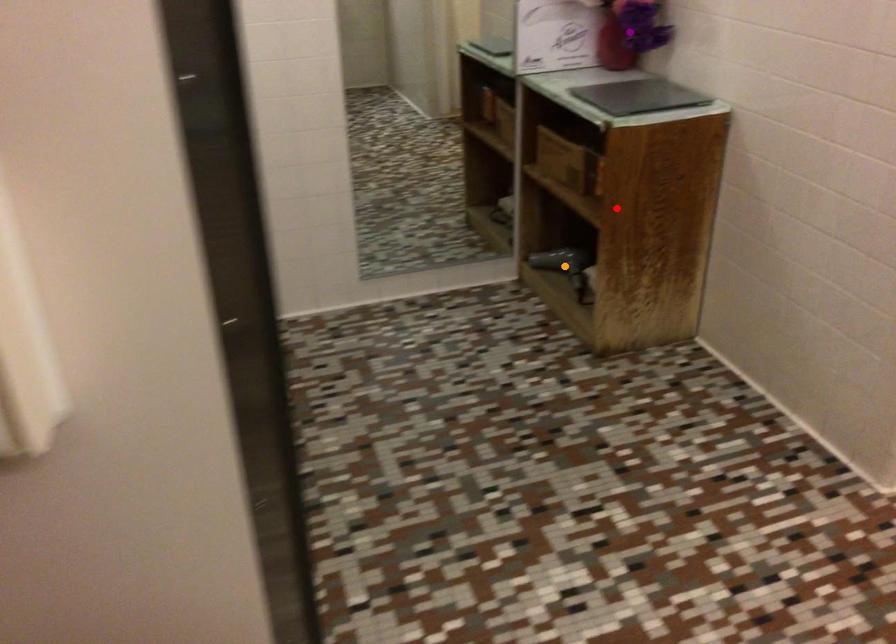
Order these from nearest to farthest:
- red point
- purple point
- orange point

red point → purple point → orange point